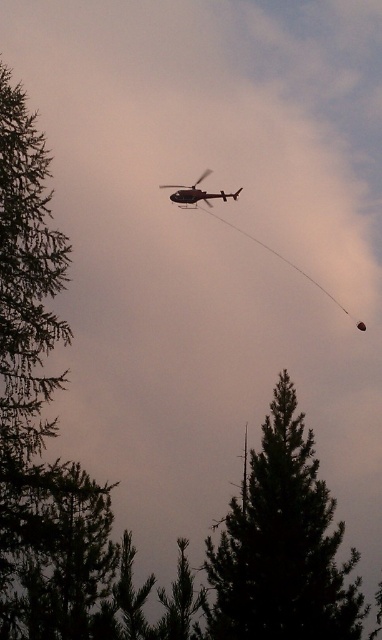
You are a drone operator trying to navigate between two points in the scene. The first point is at coordinate point at (291, 385). You need to reach the second point, which is 40.73 meters away from the first point. Given that your drone has a maximum range of 35 meters, can you safely reach the second point without exceeding your drone?

The two points are 40.73 meters apart, which exceeds the drone operator maximum range of 35 meters. Therefore, the drone cannot safely reach the second point without exceeding its range.

You are a pilot flying the metallic silver helicopter at upper center. You need to avoid hitting the dark green textured tree at center. Based on the scene, can you determine if the helicopter is currently above or below the tree?

The dark green textured tree at center is below the metallic silver helicopter at upper center, so the helicopter is currently above the tree and there is no risk of collision.

You are a pilot flying a metallic silver helicopter at upper center. You need to navigate through a narrow passage between two tall objects. One is the dark green textured tree at center and another is a similar tree not shown in the image. Can you determine which object you should avoid based on their heights?

The dark green textured tree at center has a greater height compared to the metallic silver helicopter at upper center, so you should avoid the dark green textured tree at center as it is taller and poses a collision risk.